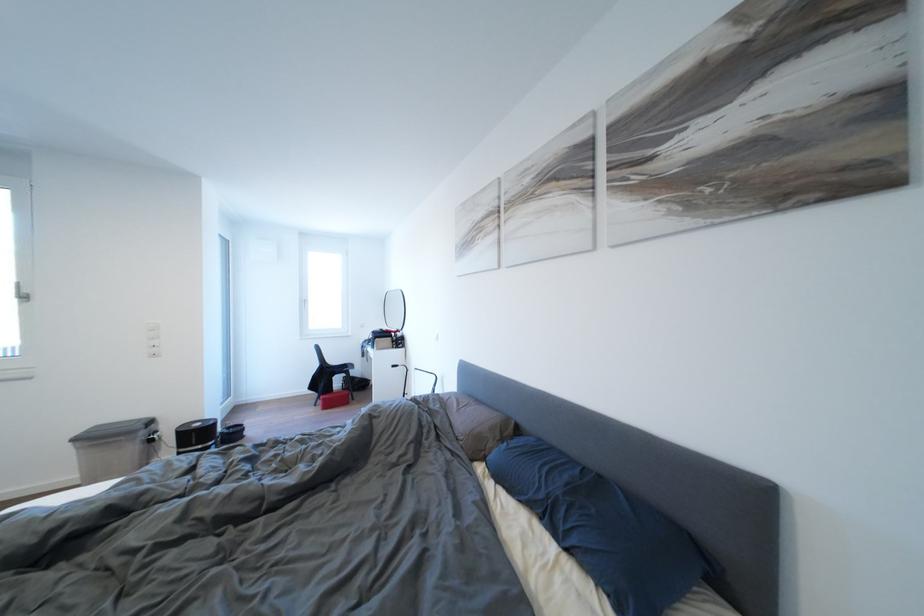
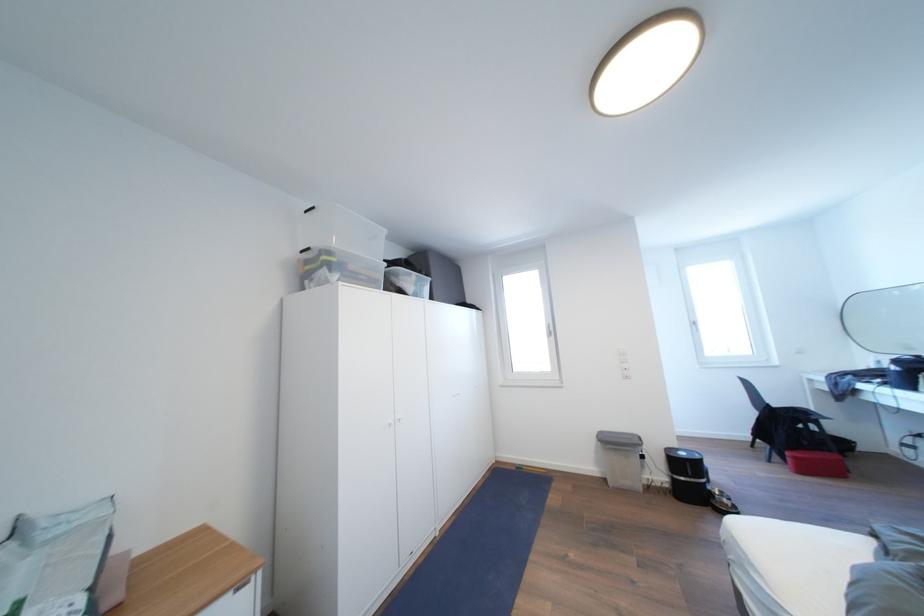
In the second image, find the point that corresponds to [205,430] in the first image.

(689, 459)